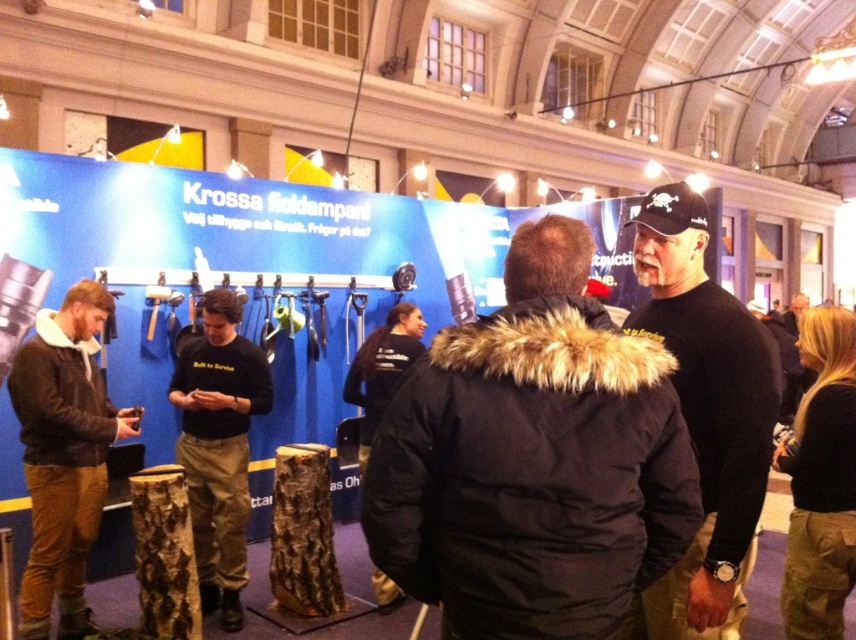
Is point (179, 401) behind point (786, 312)?

That is False.

I want to click on black cotton shirt at center, so click(218, 445).

Between point (55, 385) and point (801, 298), which one is positioned in front?

Point (55, 385) is more forward.

Is point (66, 586) closer to camera compared to point (794, 321)?

That is True.

In the scene shown: Who is more distant from viewer, (22, 371) or (792, 316)?

Point (792, 316)

Find the location of a particular element. The image size is (856, 640). brown suede jacket at left is located at coordinates (64, 454).

Is point (506, 548) positioned in front of point (681, 620)?

Yes, it is.

Who is more distant from viewer, (507, 346) or (753, 360)?

The point (753, 360) is behind.

Identify the location of black fur-lined jacket at center. (533, 460).

Find the location of a particular element. The height and width of the screenshot is (640, 856). black fur-lined jacket at center is located at coordinates click(533, 460).